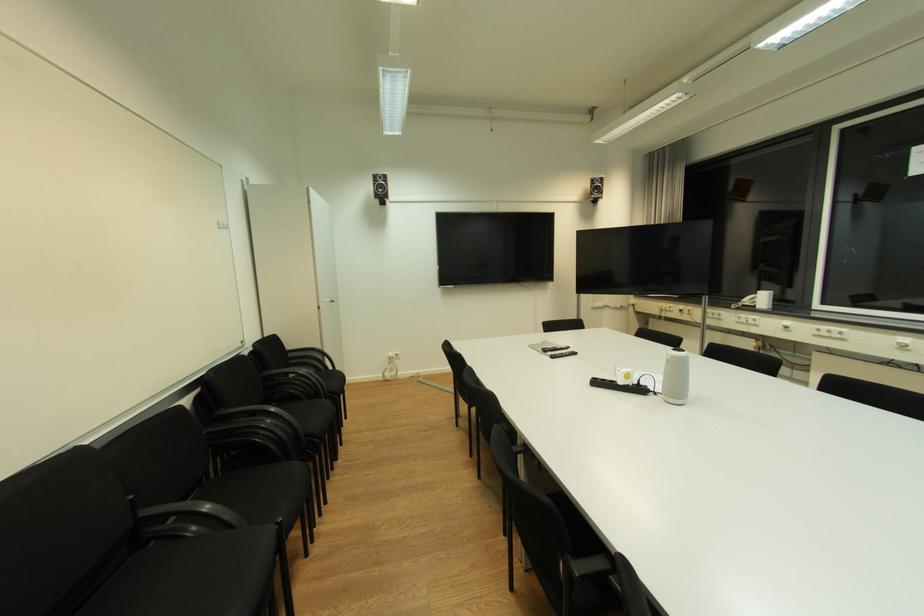
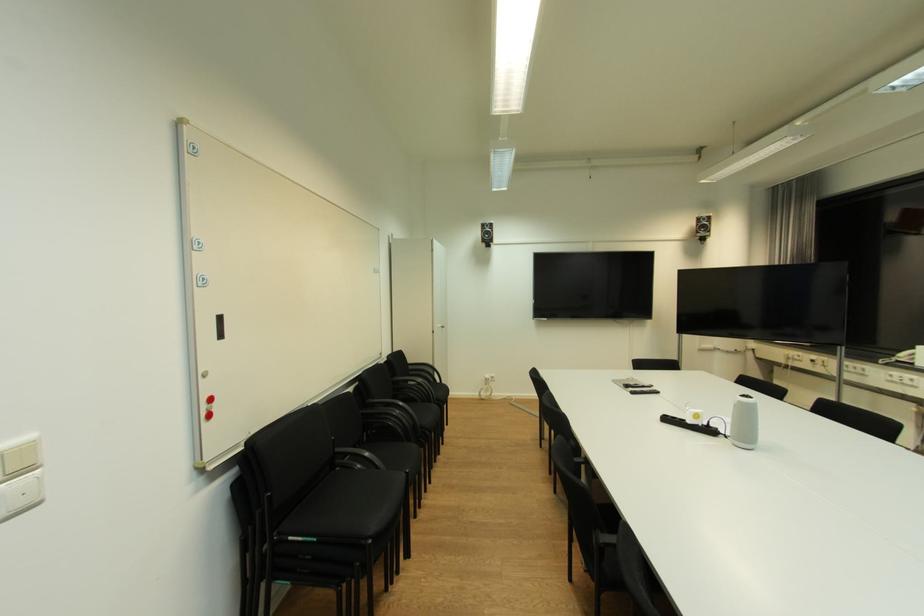
Find the pixel in the second image that matches point 602,384 in the first image.

(674, 421)